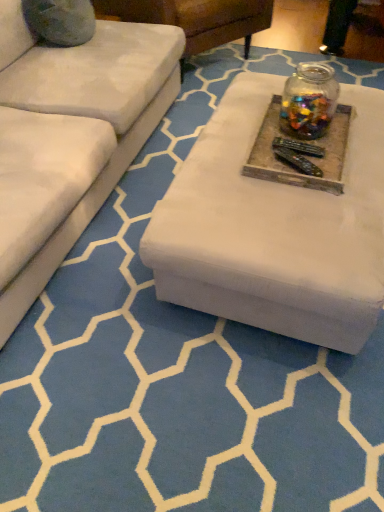
Question: Is transparent glass jar at upper center in front of or behind wooden tray at center in the image?

Choices:
 (A) front
 (B) behind

Answer: (B)

Question: Looking at the image, does transparent glass jar at upper center seem bigger or smaller compared to wooden tray at center?

Choices:
 (A) big
 (B) small

Answer: (A)

Question: From the image's perspective, is transparent glass jar at upper center located above or below wooden tray at center?

Choices:
 (A) below
 (B) above

Answer: (B)

Question: In the image, is wooden tray at center positioned in front of or behind transparent glass jar at upper center?

Choices:
 (A) behind
 (B) front

Answer: (B)

Question: Considering the positions of point (271, 152) and point (334, 90), is point (271, 152) closer or farther from the camera than point (334, 90)?

Choices:
 (A) farther
 (B) closer

Answer: (B)

Question: In the image, is wooden tray at center on the left side or the right side of transparent glass jar at upper center?

Choices:
 (A) left
 (B) right

Answer: (A)

Question: Looking at their shapes, would you say wooden tray at center is wider or thinner than transparent glass jar at upper center?

Choices:
 (A) thin
 (B) wide

Answer: (B)